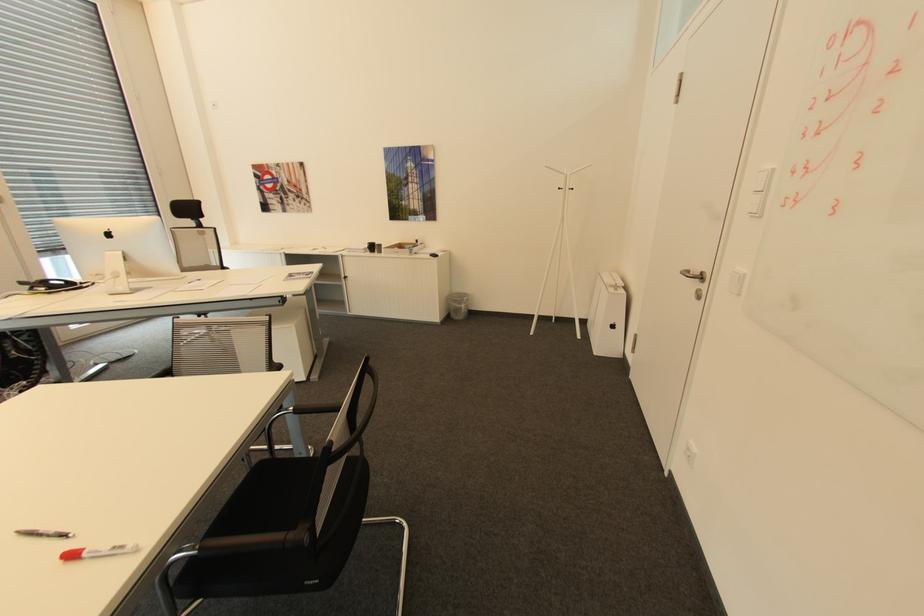
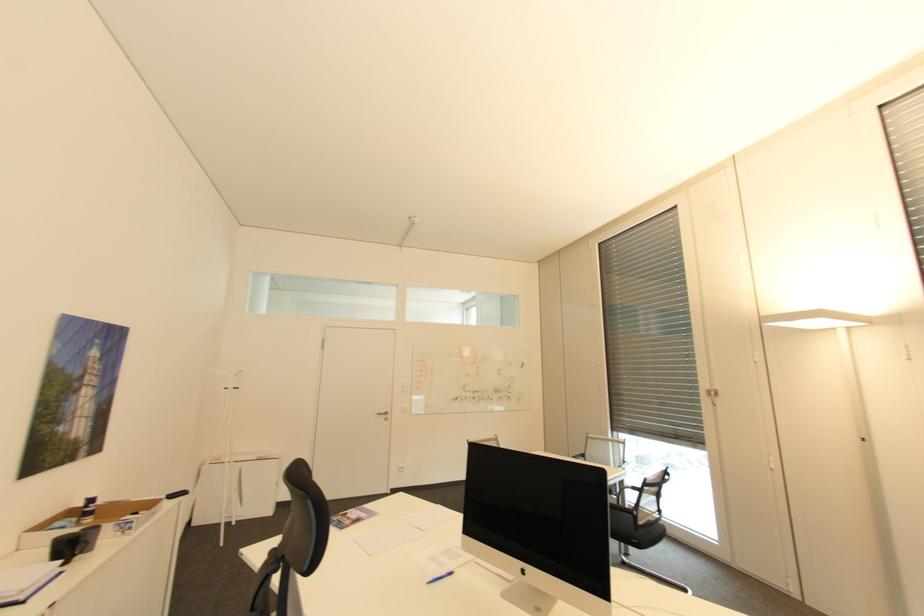
The point at (706, 277) is marked in the first image. Where is the corresponding point in the second image?

(391, 413)